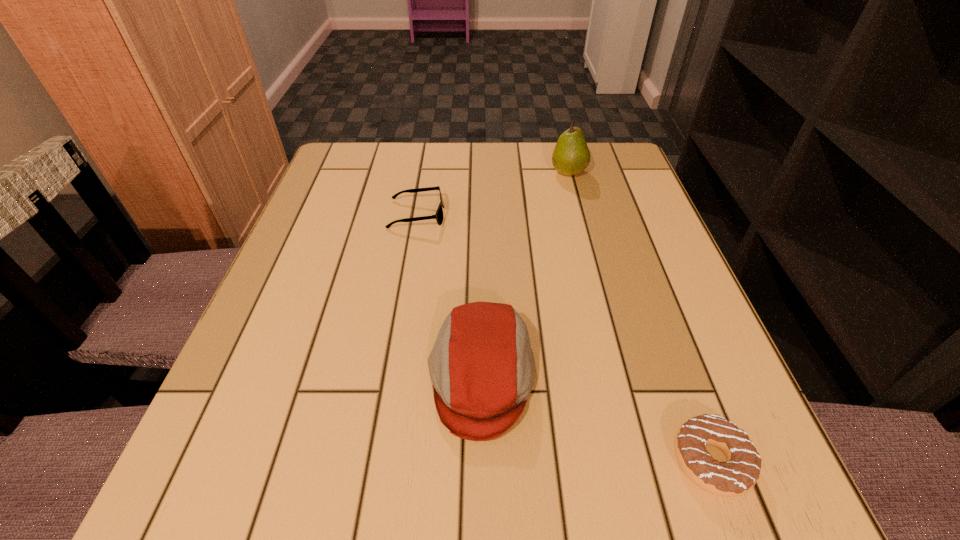
Find the location of a particular element. free space located on the left of the doughnut is located at coordinates (502, 461).

Image resolution: width=960 pixels, height=540 pixels. I want to click on object that is at the far edge, so click(x=571, y=156).

Locate an element on the screen. object present at the near edge is located at coordinates (737, 476).

Find the location of a particular element. Image resolution: width=960 pixels, height=540 pixels. pear that is at the right edge is located at coordinates point(571,156).

What are the coordinates of `doughnut situated at the right edge` in the screenshot? It's located at (737, 476).

The image size is (960, 540). I want to click on object at the far right corner, so click(571, 156).

Locate an element on the screen. Image resolution: width=960 pixels, height=540 pixels. object that is at the near right corner is located at coordinates (737, 476).

Find the location of a particular element. This screenshot has height=540, width=960. free space at the far edge of the desktop is located at coordinates (474, 150).

In the image, there is a desktop. At what (x,y) coordinates should I click in order to perform the action: click on blank space at the near edge. Please return your answer as a coordinate pair (x, y). Looking at the image, I should click on 444,475.

In the image, there is a desktop. Find the location of `free space at the left edge`. free space at the left edge is located at coordinates (328, 242).